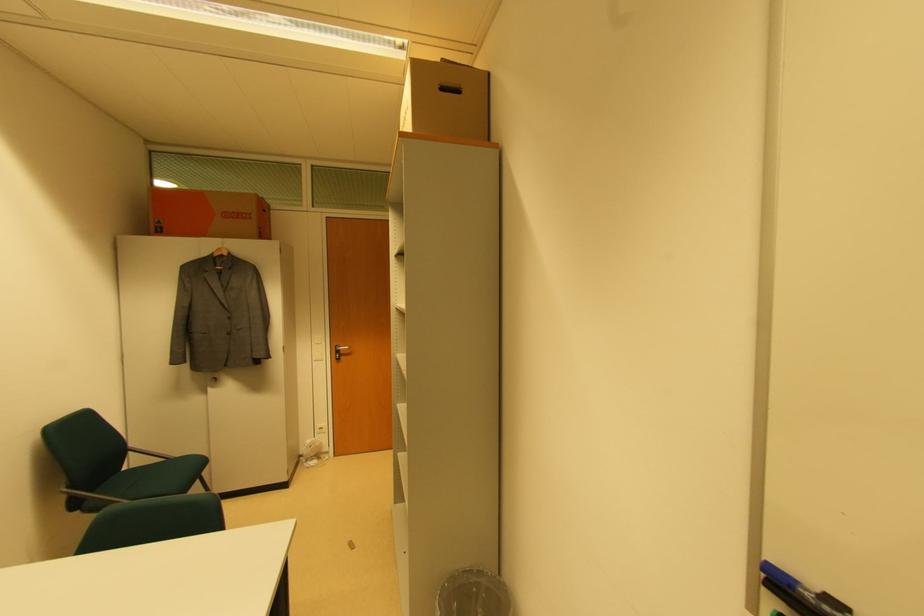
Identify the location of green chair sitting surface. The height and width of the screenshot is (616, 924). (155, 479).